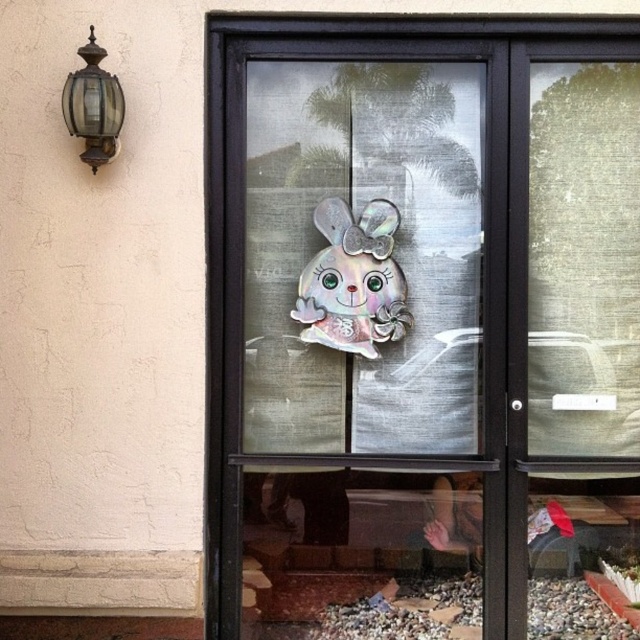
Question: Among these objects, which one is farthest from the camera?

Choices:
 (A) holographic sticker at center
 (B) bronze glass lantern at upper left

Answer: (A)

Question: Can you confirm if holographic sticker at center is positioned below bronze glass lantern at upper left?

Choices:
 (A) no
 (B) yes

Answer: (B)

Question: Can you confirm if holographic sticker at center is positioned above bronze glass lantern at upper left?

Choices:
 (A) no
 (B) yes

Answer: (A)

Question: Considering the real-world distances, which object is closest to the bronze glass lantern at upper left?

Choices:
 (A) holographic bunny at center
 (B) holographic sticker at center

Answer: (A)

Question: Which object appears closest to the camera in this image?

Choices:
 (A) bronze glass lantern at upper left
 (B) holographic bunny at center

Answer: (A)

Question: Is holographic sticker at center closer to camera compared to holographic bunny at center?

Choices:
 (A) yes
 (B) no

Answer: (A)